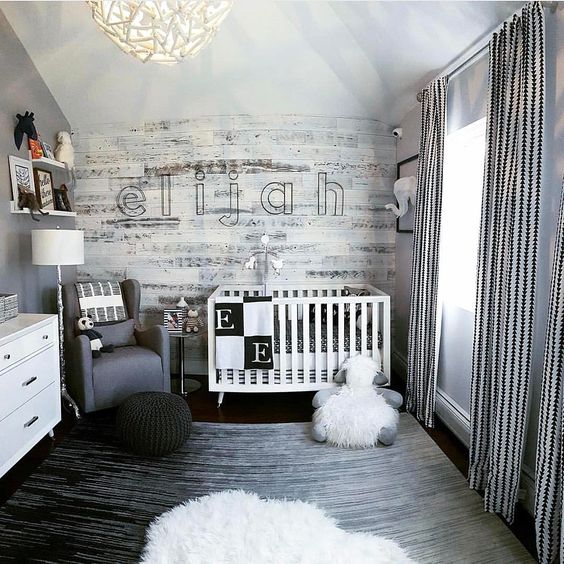
This screenshot has width=564, height=564. What are the coordinates of `lamb plush` in the screenshot? It's located at (371, 409).